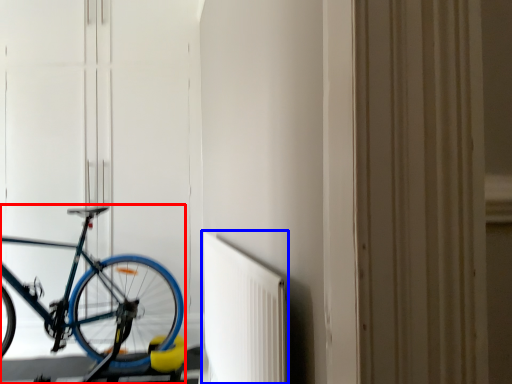
Question: Which of the following is the farthest to the observer, bicycle (highlighted by a red box) or radiator (highlighted by a blue box)?

Choices:
 (A) bicycle
 (B) radiator

Answer: (A)